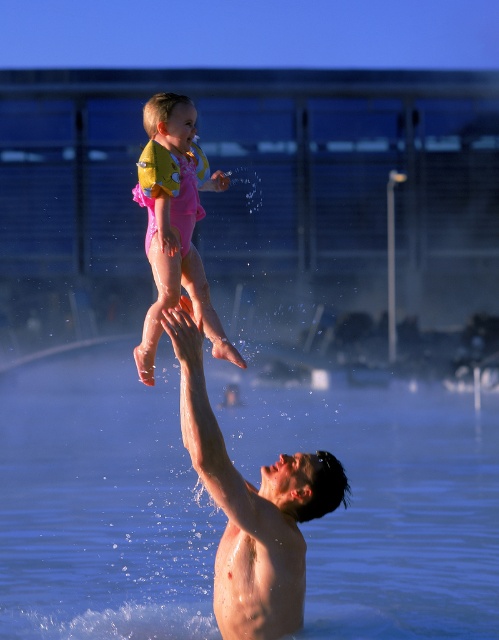
Consider the image. Based on the scene, if you were to compare the size of the clear blue water at upper center and the skinny white man at center, which one appears larger?

The clear blue water at upper center is bigger than the skinny white man at center.